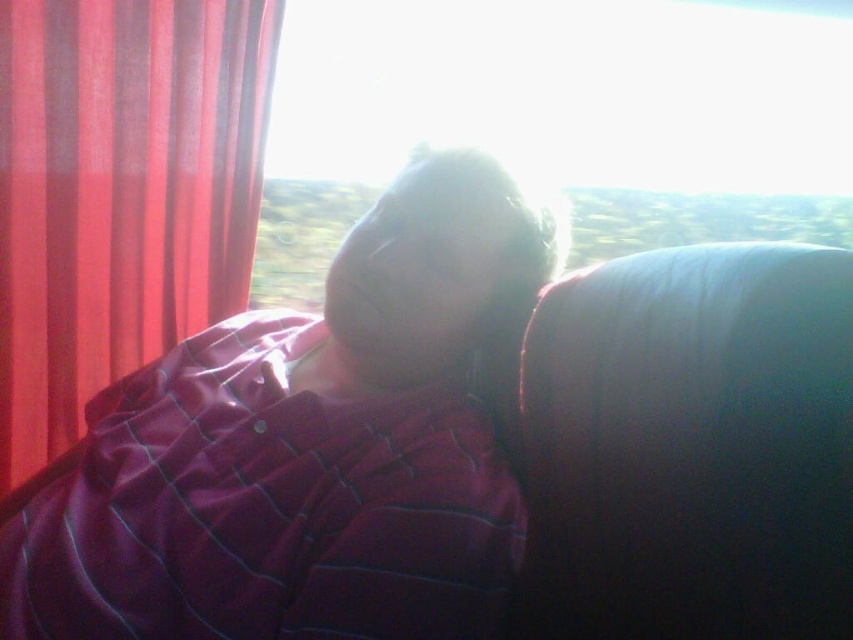
Question: Considering the real-world distances, which object is farthest from the maroon plaid shirt at center?

Choices:
 (A) velvet-like red curtain at left
 (B) transparent glass at upper center

Answer: (B)

Question: Is maroon plaid shirt at center above suede-like dark brown couch at right?

Choices:
 (A) yes
 (B) no

Answer: (B)

Question: Which point is farther to the camera?

Choices:
 (A) (656, 620)
 (B) (35, 628)
 (C) (579, 76)

Answer: (C)

Question: Is the position of suede-like dark brown couch at right less distant than that of velvet-like red curtain at left?

Choices:
 (A) no
 (B) yes

Answer: (B)

Question: Which of these objects is positioned closest to the suede-like dark brown couch at right?

Choices:
 (A) maroon plaid shirt at center
 (B) transparent glass at upper center
 (C) velvet-like red curtain at left

Answer: (A)

Question: Is maroon plaid shirt at center smaller than velvet-like red curtain at left?

Choices:
 (A) no
 (B) yes

Answer: (A)